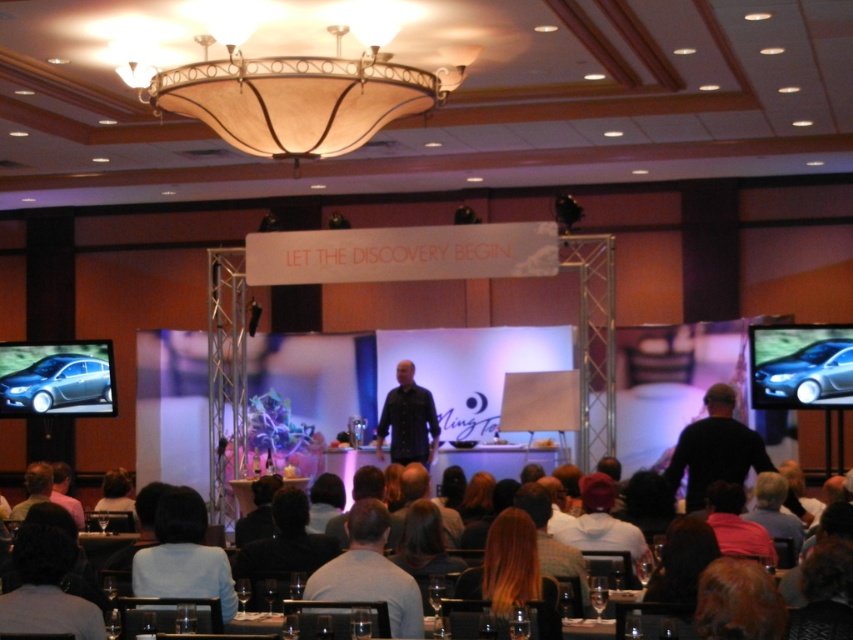
How far apart are black matte shirt at right and black shirt at center?

A distance of 3.90 meters exists between black matte shirt at right and black shirt at center.

Who is more forward, (699, 486) or (421, 464)?

Point (699, 486) is more forward.

At what (x,y) coordinates should I click in order to perform the action: click on black matte shirt at right. Please return your answer as a coordinate pair (x, y). Looking at the image, I should click on [715, 449].

Looking at this image, between metallic car at center and black matte shirt at right, which one appears on the left side from the viewer's perspective?

black matte shirt at right

Is point (781, 384) closer to viewer compared to point (734, 436)?

That is False.

Who is more forward, (848,388) or (670,461)?

Point (670,461) is in front.

The height and width of the screenshot is (640, 853). In order to click on metallic car at center in this screenshot , I will do `click(799, 365)`.

Is point (755, 360) farther from camera compared to point (361, 500)?

Yes, point (755, 360) is farther from viewer.

Which is in front, point (819, 365) or point (408, 586)?

Point (408, 586)

Is point (773, 406) positioned before point (354, 544)?

That is False.

I want to click on metallic car at center, so click(x=799, y=365).